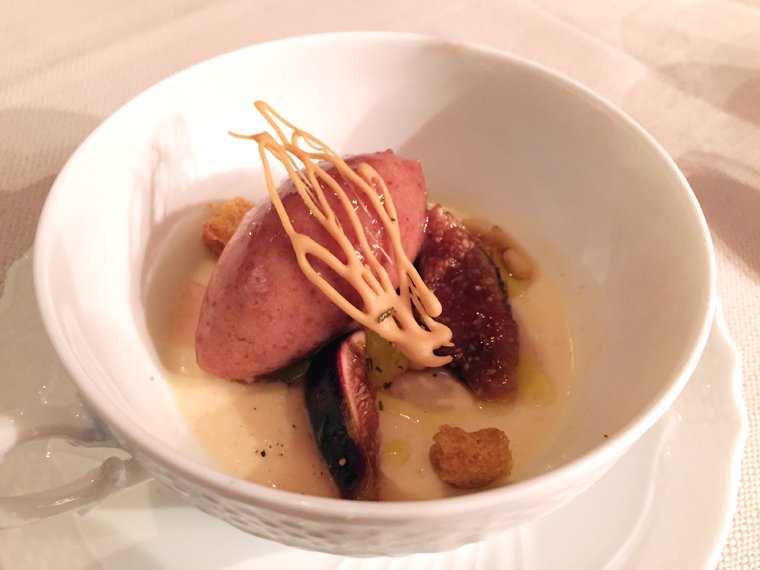
Identify the location of bowl. This screenshot has width=760, height=570. 133,390.